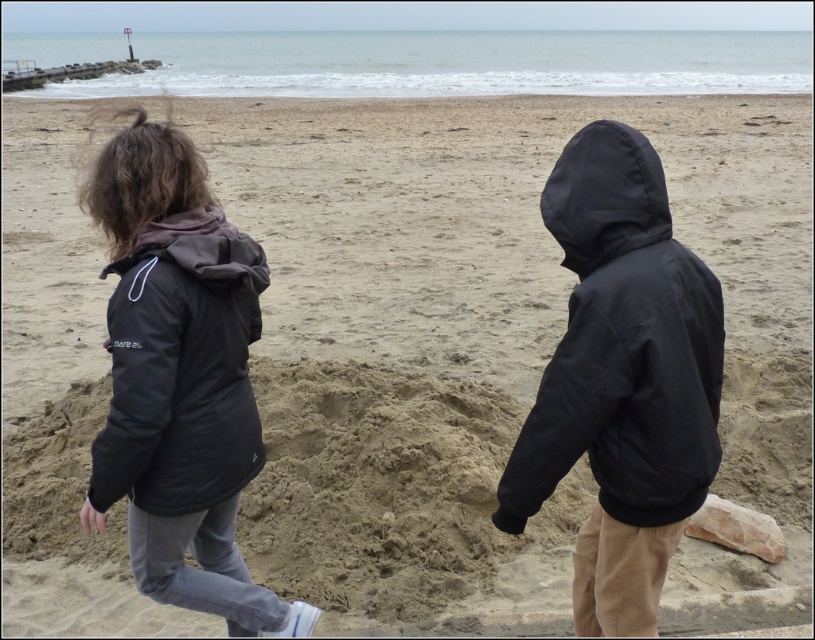
You are a photographer trying to capture a photo of the two people on the beach. You need to ensure that both the black matte jacket at right and the black matte hood at upper right are clearly visible in the frame. Based on their positions, which object is closer to the camera?

The black matte jacket at right is located below the black matte hood at upper right, meaning the jacket is closer to the camera than the hood.